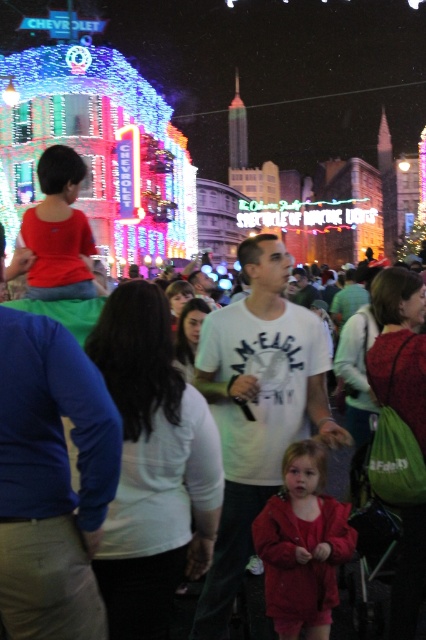
You are organizing a photo shoot and need to ensure that the white cotton shirt at center and the matte red coat at center are visible in the frame. Given that the camera has a fixed focus area, which object should you prioritize positioning closer to the camera to ensure visibility?

The white cotton shirt at center has a larger width than the matte red coat at center, so you should prioritize positioning the white cotton shirt at center closer to the camera to ensure visibility.

You are organizing a photo shoot and need to ensure that the white cotton shirt at center and the matte red coat at center are visible in the frame. Given their sizes, which object should you focus on to ensure both are captured clearly?

The white cotton shirt at center is larger than the matte red coat at center. To ensure both are visible, focus on the white cotton shirt at center as it occupies more space, allowing the smaller matte red coat at center to be included in the frame.